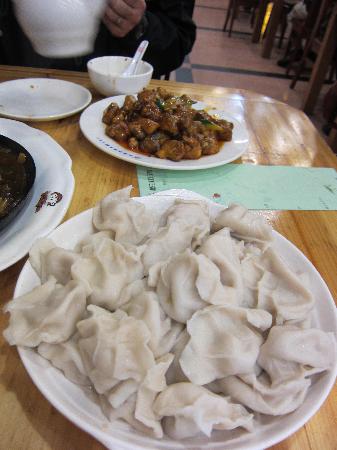
You are a GUI agent. You are given a task and a screenshot of the screen. Output one action in this format:
    pyautogui.click(x=<x>, y=<y>)
    Task: Click on the bowl
    
    Given the screenshot: What is the action you would take?
    pyautogui.click(x=137, y=154)